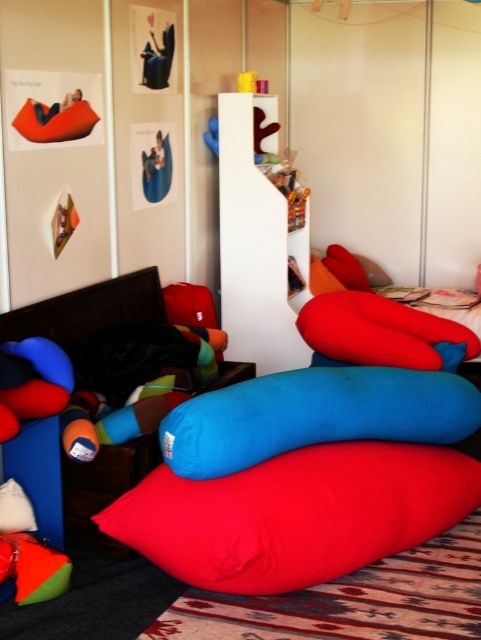
Question: Observing the image, what is the correct spatial positioning of blue soft cushion at center in reference to red soft cushion at center?

Choices:
 (A) right
 (B) left

Answer: (B)

Question: Can you confirm if matte red beanbag at lower center is positioned above red soft cushion at center?

Choices:
 (A) no
 (B) yes

Answer: (A)

Question: Which point is farther to the camera?

Choices:
 (A) (382, 356)
 (B) (330, 467)

Answer: (A)

Question: Which point appears closest to the camera in this image?

Choices:
 (A) (438, 324)
 (B) (207, 403)
 (C) (367, 548)

Answer: (B)

Question: Does matte red beanbag at lower center appear on the left side of red soft cushion at center?

Choices:
 (A) no
 (B) yes

Answer: (B)

Question: Which object is positioned closest to the matte red beanbag at lower center?

Choices:
 (A) red soft cushion at center
 (B) blue soft cushion at center

Answer: (B)